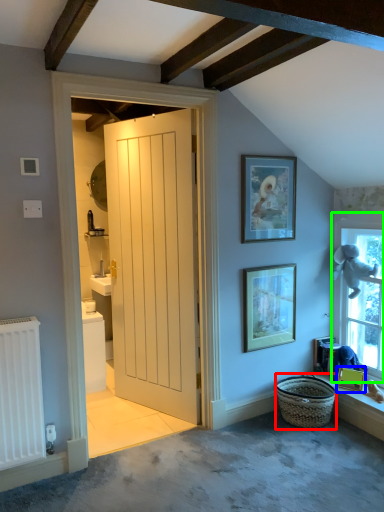
Question: Which is farther away from basket (highlighted by a red box)? picture frame (highlighted by a blue box) or window (highlighted by a green box)?

Choices:
 (A) picture frame
 (B) window

Answer: (B)